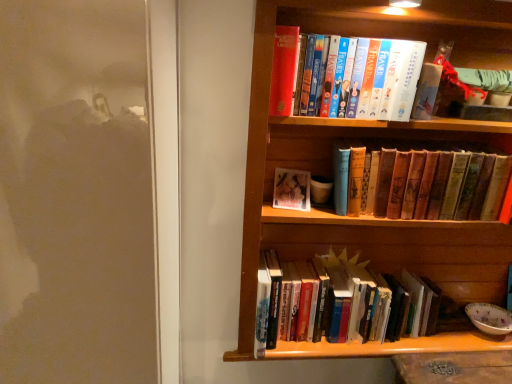
Question: Does wooden bookcase at upper right have a greater width compared to hardcover books at center, which is counted as the third book, starting from the top?

Choices:
 (A) yes
 (B) no

Answer: (A)

Question: Is wooden bookcase at upper right next to hardcover books at center, which is counted as the third book, starting from the top, and touching it?

Choices:
 (A) yes
 (B) no

Answer: (B)

Question: From a real-world perspective, is wooden bookcase at upper right beneath hardcover books at center, which is counted as the third book, starting from the top?

Choices:
 (A) yes
 (B) no

Answer: (B)

Question: Considering the relative positions of wooden bookcase at upper right and hardcover books at center, acting as the first book starting from the bottom, in the image provided, is wooden bookcase at upper right to the right of hardcover books at center, acting as the first book starting from the bottom, from the viewer's perspective?

Choices:
 (A) yes
 (B) no

Answer: (A)

Question: Is wooden bookcase at upper right turned away from hardcover books at center, acting as the first book starting from the bottom?

Choices:
 (A) yes
 (B) no

Answer: (A)

Question: Is vintage leather book at center, positioned as the 2th book in bottom-to-top order, in front of or behind wooden bookcase at upper right in the image?

Choices:
 (A) behind
 (B) front

Answer: (A)

Question: Based on their sizes in the image, would you say vintage leather book at center, acting as the 2th book starting from the top, is bigger or smaller than wooden bookcase at upper right?

Choices:
 (A) small
 (B) big

Answer: (A)

Question: From a real-world perspective, relative to wooden bookcase at upper right, is vintage leather book at center, acting as the 2th book starting from the top, vertically above or below?

Choices:
 (A) above
 (B) below

Answer: (A)

Question: Based on their positions, is vintage leather book at center, acting as the 2th book starting from the top, located to the left or right of wooden bookcase at upper right?

Choices:
 (A) left
 (B) right

Answer: (B)

Question: Is vintage leather book at center, acting as the 2th book starting from the top, wider or thinner than hardcover book at upper center, which is counted as the third book, starting from the bottom?

Choices:
 (A) thin
 (B) wide

Answer: (A)

Question: Looking at the image, does vintage leather book at center, positioned as the 2th book in bottom-to-top order, seem bigger or smaller compared to hardcover book at upper center, which is counted as the third book, starting from the bottom?

Choices:
 (A) small
 (B) big

Answer: (B)

Question: Is vintage leather book at center, acting as the 2th book starting from the top, in front of or behind hardcover book at upper center, which is counted as the third book, starting from the bottom, in the image?

Choices:
 (A) behind
 (B) front

Answer: (A)

Question: From a real-world perspective, is vintage leather book at center, positioned as the 2th book in bottom-to-top order, physically located above or below hardcover book at upper center, the 1th book in the top-to-bottom sequence?

Choices:
 (A) above
 (B) below

Answer: (B)

Question: From their relative heights in the image, would you say hardcover books at center, acting as the first book starting from the bottom, is taller or shorter than wooden bookcase at upper right?

Choices:
 (A) tall
 (B) short

Answer: (B)

Question: Considering their positions, is hardcover books at center, which is counted as the third book, starting from the top, located in front of or behind wooden bookcase at upper right?

Choices:
 (A) front
 (B) behind

Answer: (B)